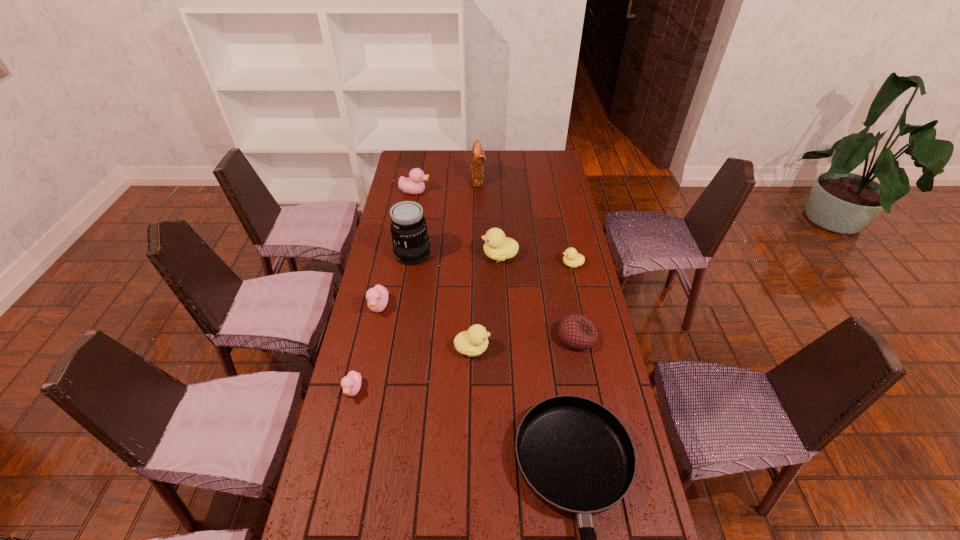
Image resolution: width=960 pixels, height=540 pixels. Find the location of `the smallest yellow duckling`. the smallest yellow duckling is located at coordinates (571, 258).

What are the coordinates of `the rightmost yellow duckling` in the screenshot? It's located at (571, 258).

Locate an element on the screen. This screenshot has height=540, width=960. the second nearest object is located at coordinates (351, 384).

Locate an element on the screen. the smallest pink duckling is located at coordinates tap(351, 384).

Locate an element on the screen. free spot located on the left of the tallest object is located at coordinates pos(382,254).

Image resolution: width=960 pixels, height=540 pixels. What are the coordinates of `vacant space located 0.210m on the open side of the ninth shortest object` in the screenshot? It's located at (528, 180).

Image resolution: width=960 pixels, height=540 pixels. What are the coordinates of `vacant space located 0.200m at the beak of the biggest yellow duckling` in the screenshot? It's located at (432, 255).

I want to click on free space located 0.220m at the beak of the biggest yellow duckling, so click(427, 255).

The width and height of the screenshot is (960, 540). Identify the location of vacant space located at the beak of the biggest yellow duckling. [x=447, y=255].

This screenshot has height=540, width=960. I want to click on vacant point located on the front-facing side of the farthest duckling, so click(x=481, y=192).